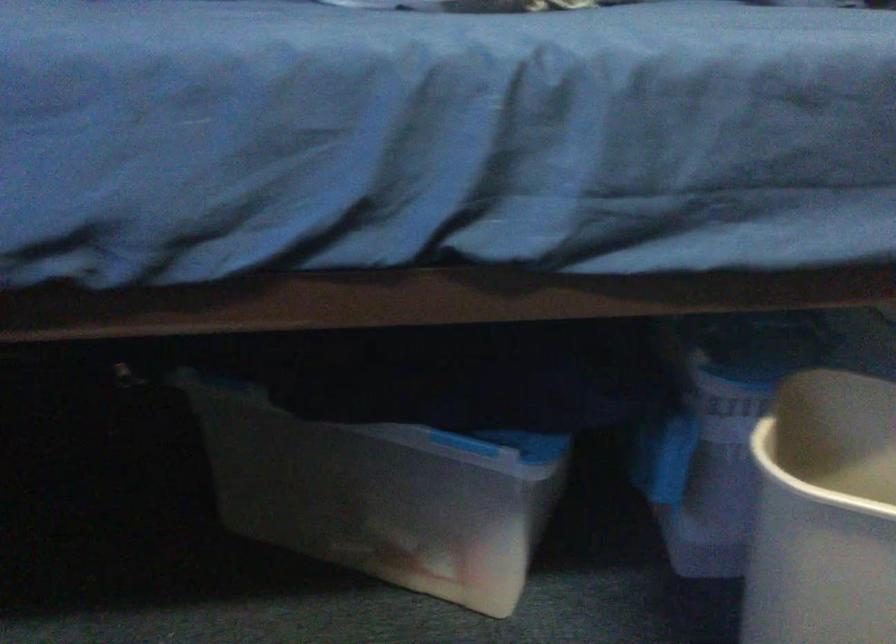
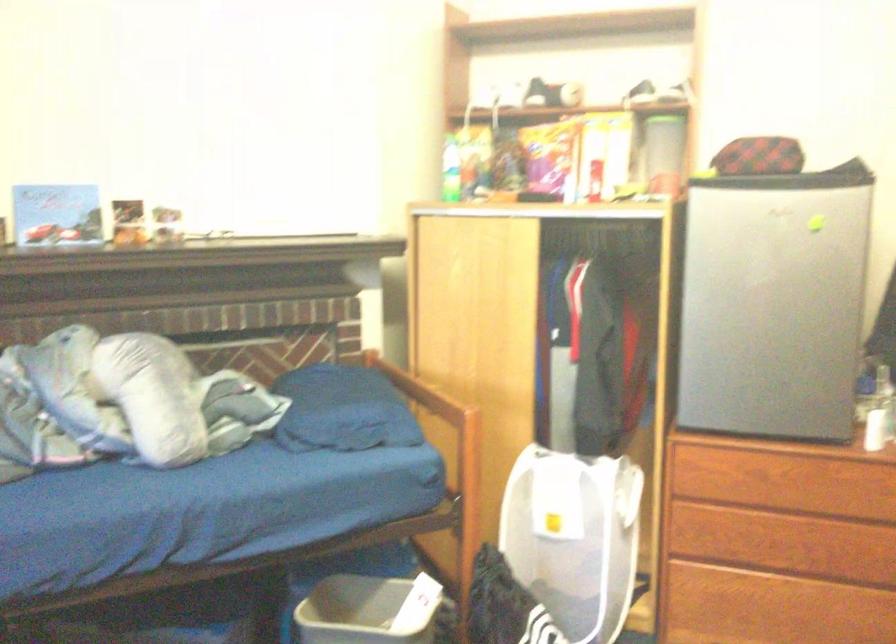
Question: Which direction would the cameraman need to move to produce the second image? Reply with the corresponding letter.

Choices:
 (A) Left
 (B) Right
 (C) Forward
 (D) Backward

Answer: (D)